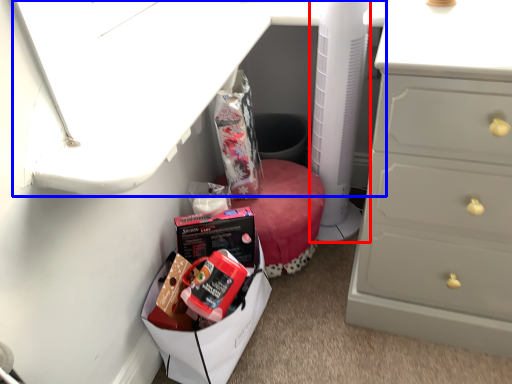
Question: Which object is closer to the camera taking this photo, appliance (highlighted by a red box) or vanity (highlighted by a blue box)?

Choices:
 (A) appliance
 (B) vanity

Answer: (B)